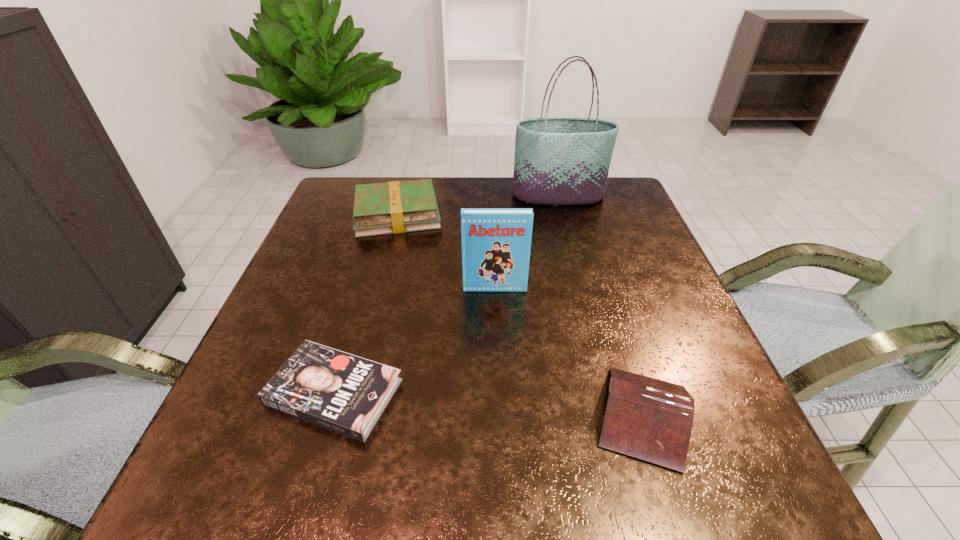
Image resolution: width=960 pixels, height=540 pixels. Identify the location of vacant point located on the front of the shortest book. (303, 496).

Image resolution: width=960 pixels, height=540 pixels. Find the location of `tote bag located in the far edge section of the desktop`. tote bag located in the far edge section of the desktop is located at coordinates (558, 160).

You are a GUI agent. You are given a task and a screenshot of the screen. Output one action in this format:
    pyautogui.click(x=<x>, y=<y>)
    Task: Click on the book that is at the far edge
    This screenshot has height=540, width=960.
    Given the screenshot: What is the action you would take?
    coord(394,207)

Find the location of a particular element. The height and width of the screenshot is (540, 960). object located in the near edge section of the desktop is located at coordinates (649, 419).

At what (x,y) coordinates should I click in order to perform the action: click on tote bag located in the right edge section of the desktop. Please return your answer as a coordinate pair (x, y). Image resolution: width=960 pixels, height=540 pixels. Looking at the image, I should click on (558, 160).

The width and height of the screenshot is (960, 540). In order to click on book located at the right edge in this screenshot , I will do `click(649, 419)`.

Locate an element on the screen. This screenshot has width=960, height=540. object at the far left corner is located at coordinates point(394,207).

Where is `object at the far right corner`? object at the far right corner is located at coordinates [558, 160].

Locate an element on the screen. object located in the near right corner section of the desktop is located at coordinates (649, 419).

Locate an element on the screen. free spot at the near edge of the desktop is located at coordinates (575, 500).